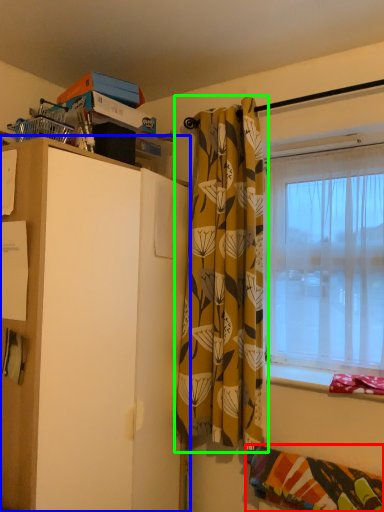
Question: Based on their relative distances, which object is nearer to blanket (highlighted by a red box)? Choose from cabinetry (highlighted by a blue box) and curtain (highlighted by a green box).

Choices:
 (A) cabinetry
 (B) curtain

Answer: (B)